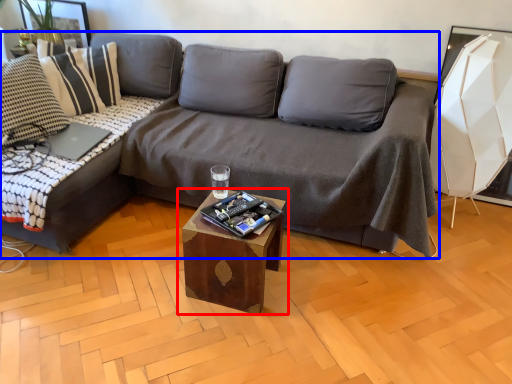
Question: Which point is closer to the camera, table (highlighted by a red box) or studio couch (highlighted by a blue box)?

Choices:
 (A) table
 (B) studio couch

Answer: (B)